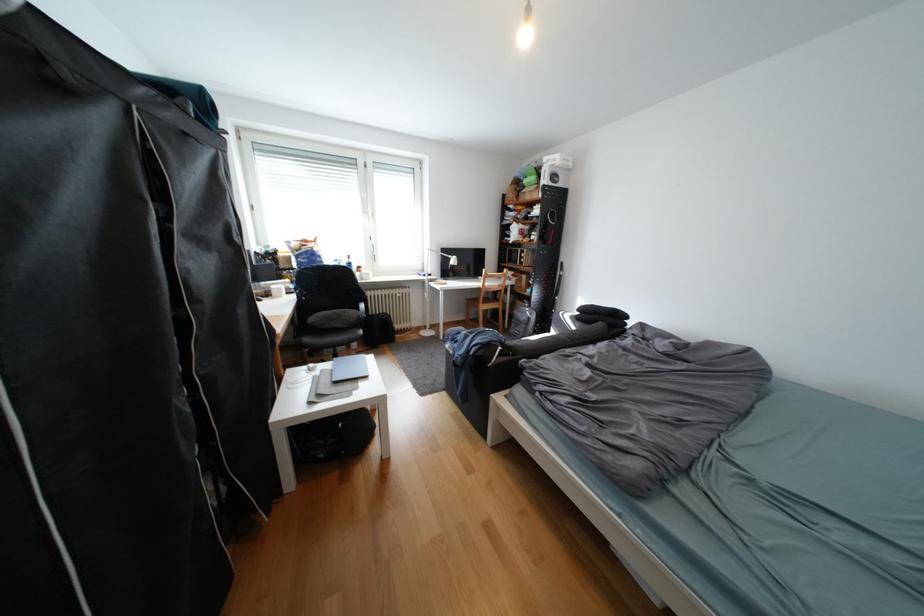
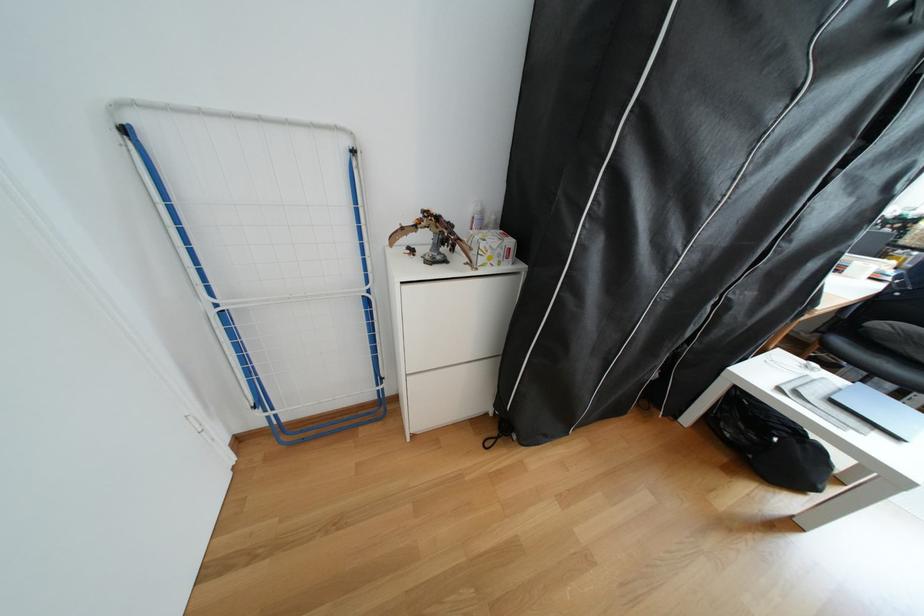
Find the pixel in the second image that matches the point at 325,320 in the first image.

(894, 326)